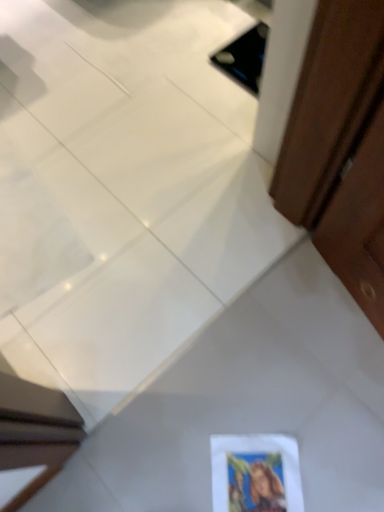
This screenshot has width=384, height=512. Find the location of `vacant space that is to the left of white paper postcard at lower center`. vacant space that is to the left of white paper postcard at lower center is located at coordinates (167, 467).